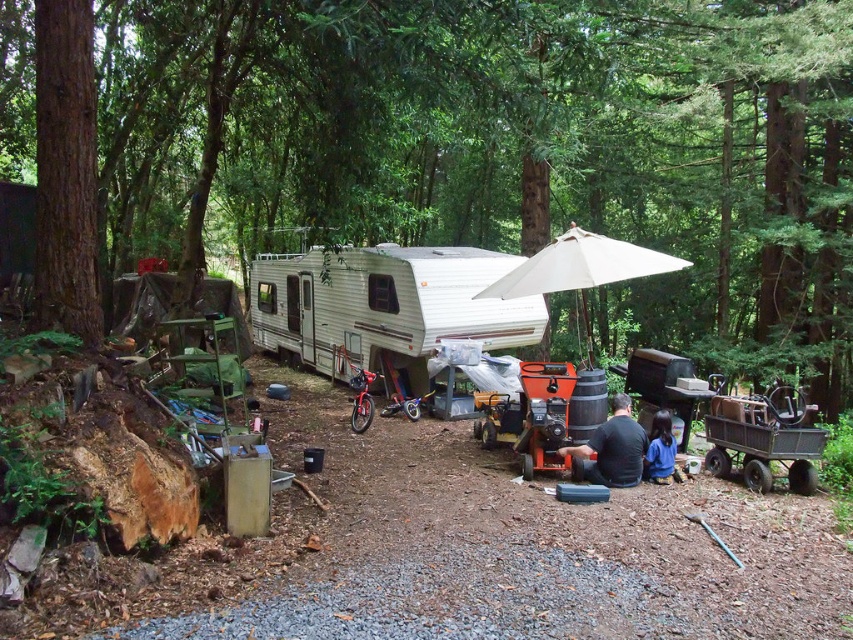
Question: Among these points, which one is nearest to the camera?

Choices:
 (A) coord(363,269)
 (B) coord(613,417)

Answer: (B)

Question: Estimate the real-world distances between objects in this image. Which object is closer to the black matte shirt at center?

Choices:
 (A) blue fabric jacket at lower right
 (B) green textured tree at center
 (C) white fabric umbrella at center

Answer: (A)

Question: Is white vinyl camper at center above brown rough bark tree at upper left?

Choices:
 (A) no
 (B) yes

Answer: (B)

Question: Which point appears farthest from the camera in this image?

Choices:
 (A) (305, 182)
 (B) (434, 253)
 (C) (602, 275)
 (D) (582, 472)

Answer: (B)

Question: From the image, what is the correct spatial relationship of green textured tree at center in relation to brown rough bark tree at upper left?

Choices:
 (A) right
 (B) left

Answer: (A)

Question: Can you confirm if brown rough bark tree at upper left is wider than white fabric umbrella at center?

Choices:
 (A) yes
 (B) no

Answer: (B)